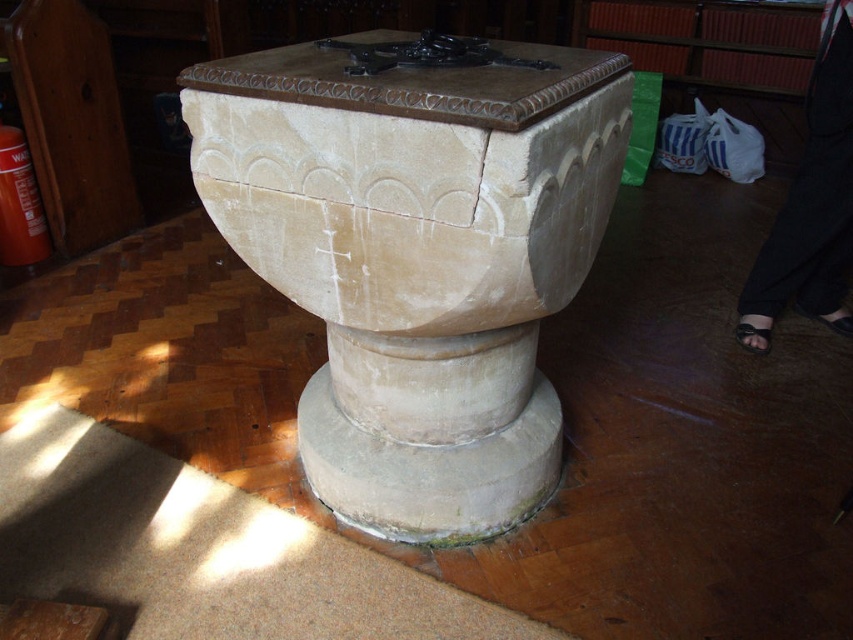
The width and height of the screenshot is (853, 640). Describe the element at coordinates (416, 257) in the screenshot. I see `beige stone baptismal font at center` at that location.

Which of these two, beige stone baptismal font at center or white stone pedestal at center, stands shorter?

With less height is white stone pedestal at center.

Between point (590, 244) and point (125, 570), which one is positioned behind?

Positioned behind is point (125, 570).

Find the location of a particular element. The width and height of the screenshot is (853, 640). beige stone baptismal font at center is located at coordinates (416, 257).